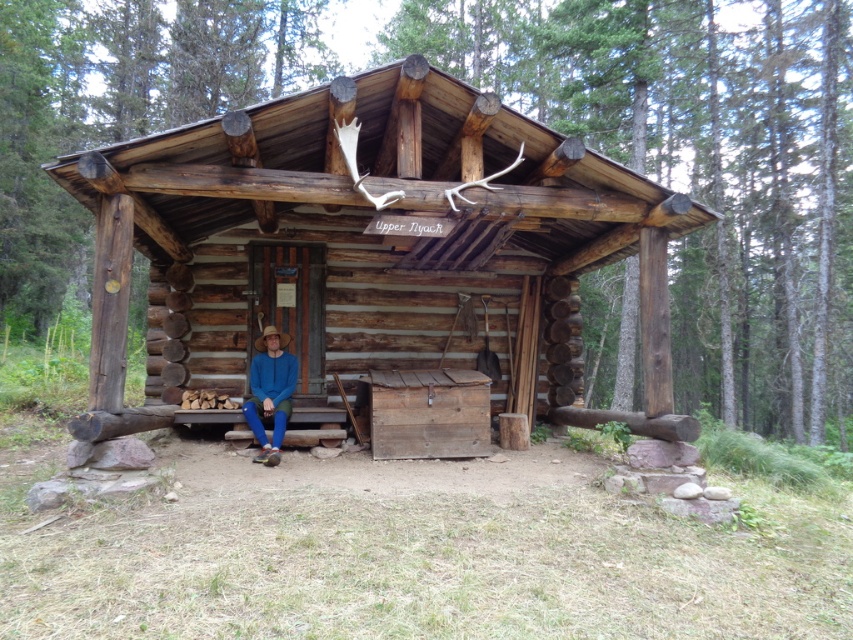
In the scene shown: Can you confirm if rustic wooden cabin at center is positioned below blue cotton shirt at center?

Incorrect, rustic wooden cabin at center is not positioned below blue cotton shirt at center.

Between point (247, 115) and point (259, 369), which one is positioned in front?

Point (247, 115)

This screenshot has width=853, height=640. Identify the location of rustic wooden cabin at center. (367, 248).